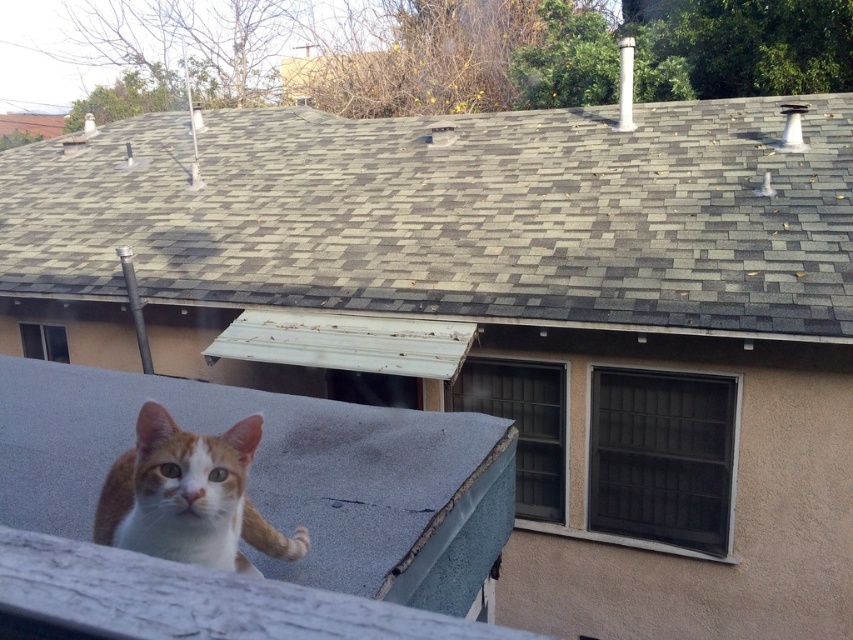
You are a drone operator trying to land a drone on the roof where the cat is. The drone has a landing pad that must align with the point at coordinates point [456,216]. Based on the scene description, where should you direct the drone to land?

The point at coordinates point [456,216] is located on the gray shingles at upper center of the roof. Therefore, you should direct the drone to land on the gray shingles at upper center of the roof where the cat is perched.

You are a bird flying over the residential area and want to land on the gray shingles at upper center where the orange tabby cat at lower left is currently sitting. Can you safely land there?

The gray shingles at upper center is located above the orange tabby cat at lower left, so the cat is not on the shingles but below them. Therefore, the bird can safely land on the gray shingles at upper center.

You are a drone operator trying to land a drone on the gray shingles at upper center. The drone has a GPS coordinate system where the top left corner of the image is the origin point. The coordinates are given as a percentage of the image dimensions. Where should you direct the drone to land?

The gray shingles at upper center are located at point 0.338 on the x axis and 0.535 on the y axis, so you should direct the drone to land there.